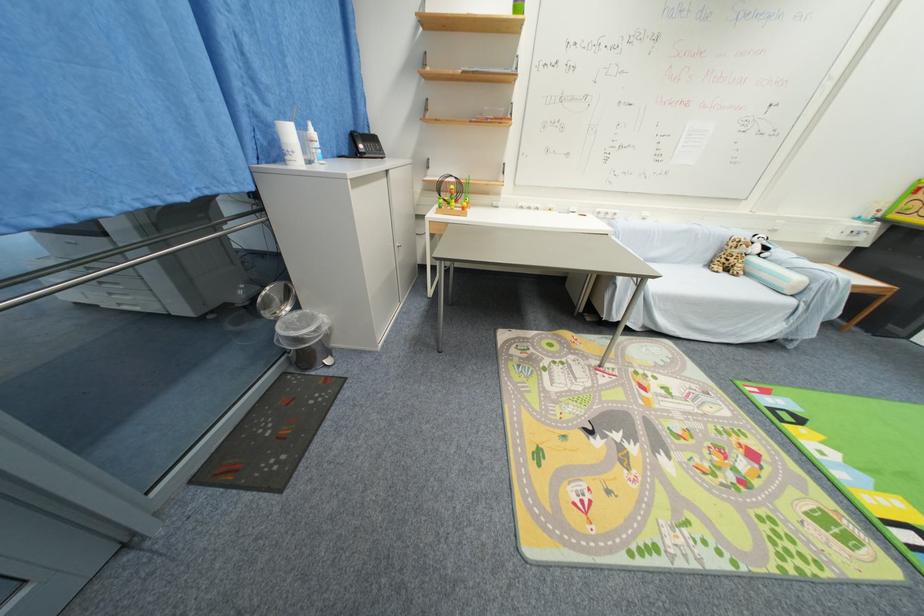
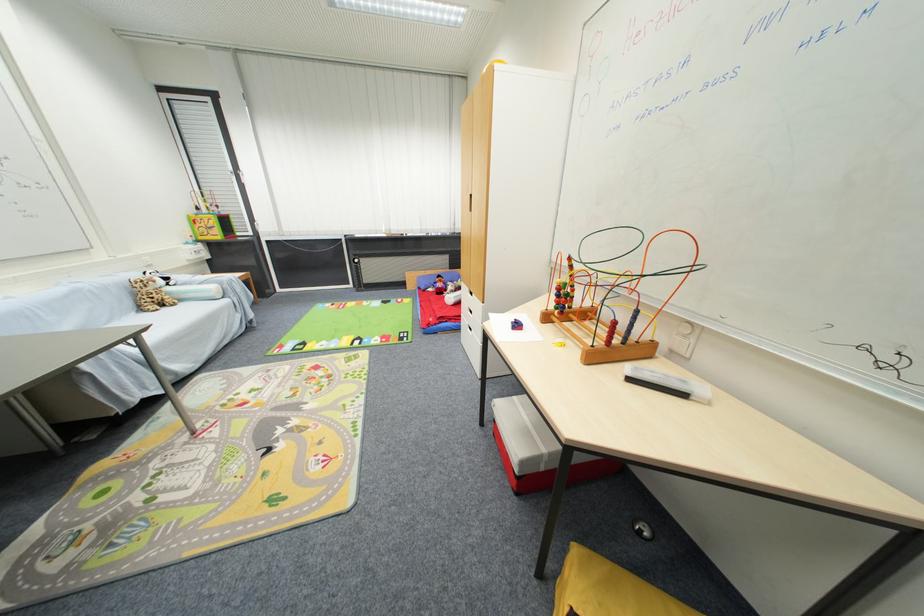
Locate, in the second image, the point that corresponds to (862,227) in the first image.

(198, 249)